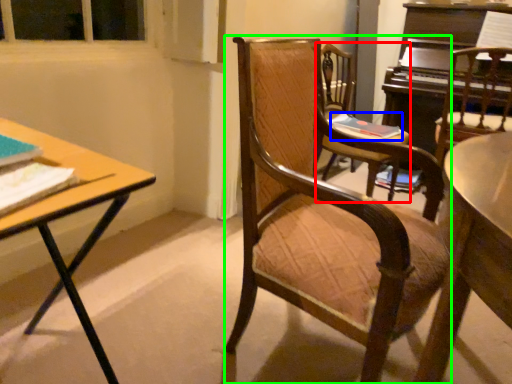
Question: Which is farther away from chair (highlighted by a red box)? book (highlighted by a blue box) or chair (highlighted by a green box)?

Choices:
 (A) book
 (B) chair

Answer: (B)